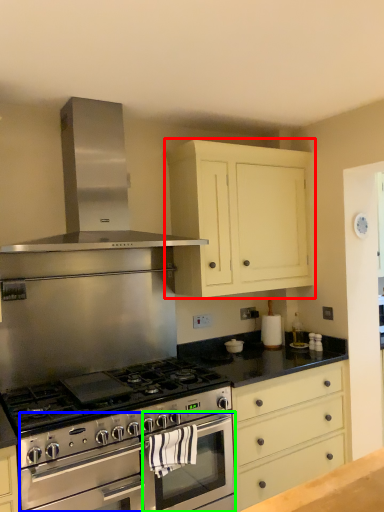
Question: Which object is the farthest from cabinetry (highlighted by a red box)? Choose among these: oven (highlighted by a blue box) or oven (highlighted by a green box).

Choices:
 (A) oven
 (B) oven

Answer: (A)